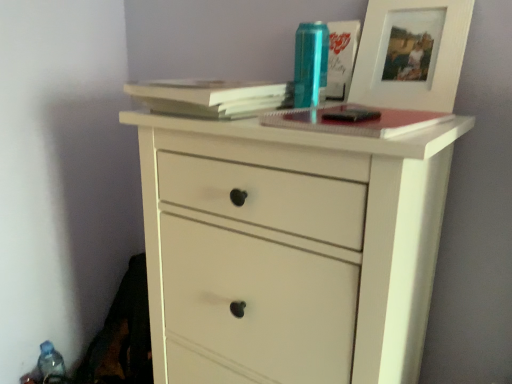
Question: Are light brown paper at upper center, positioned as the 1th paperback book in left-to-right order, and blue plastic bottle at lower left, the first bottle from the left, far apart?

Choices:
 (A) yes
 (B) no

Answer: (B)

Question: Can you confirm if light brown paper at upper center, positioned as the 2th paperback book in right-to-left order, is wider than blue plastic bottle at lower left, arranged as the second bottle when viewed from the front?

Choices:
 (A) no
 (B) yes

Answer: (B)

Question: Does light brown paper at upper center, positioned as the 1th paperback book in left-to-right order, have a lesser height compared to blue plastic bottle at lower left, the second bottle when ordered from right to left?

Choices:
 (A) no
 (B) yes

Answer: (B)

Question: From the image's perspective, is light brown paper at upper center, positioned as the 2th paperback book in right-to-left order, located above blue plastic bottle at lower left, positioned as the first bottle in back-to-front order?

Choices:
 (A) no
 (B) yes

Answer: (B)

Question: Considering the relative sizes of light brown paper at upper center, positioned as the 2th paperback book in right-to-left order, and blue plastic bottle at lower left, which is the first bottle from bottom to top, in the image provided, is light brown paper at upper center, positioned as the 2th paperback book in right-to-left order, taller than blue plastic bottle at lower left, which is the first bottle from bottom to top,?

Choices:
 (A) yes
 (B) no

Answer: (B)

Question: Can you confirm if light brown paper at upper center, positioned as the 2th paperback book in right-to-left order, is smaller than blue plastic bottle at lower left, placed as the 2th bottle when sorted from top to bottom?

Choices:
 (A) no
 (B) yes

Answer: (A)

Question: Is metallic blue can at upper center, the first bottle positioned from the top, facing towards white matte chest of drawers at center?

Choices:
 (A) yes
 (B) no

Answer: (B)

Question: From a real-world perspective, is metallic blue can at upper center, the first bottle positioned from the top, physically above white matte chest of drawers at center?

Choices:
 (A) no
 (B) yes

Answer: (B)

Question: Does metallic blue can at upper center, positioned as the 1th bottle in front-to-back order, appear on the left side of white matte chest of drawers at center?

Choices:
 (A) yes
 (B) no

Answer: (B)

Question: From a real-world perspective, does metallic blue can at upper center, the first bottle viewed from the right, sit lower than white matte chest of drawers at center?

Choices:
 (A) no
 (B) yes

Answer: (A)

Question: Is metallic blue can at upper center, the first bottle viewed from the right, closer to the viewer compared to white matte chest of drawers at center?

Choices:
 (A) no
 (B) yes

Answer: (A)

Question: Is the depth of light brown paper at upper center, positioned as the 2th paperback book in right-to-left order, less than that of white matte chest of drawers at center?

Choices:
 (A) no
 (B) yes

Answer: (A)